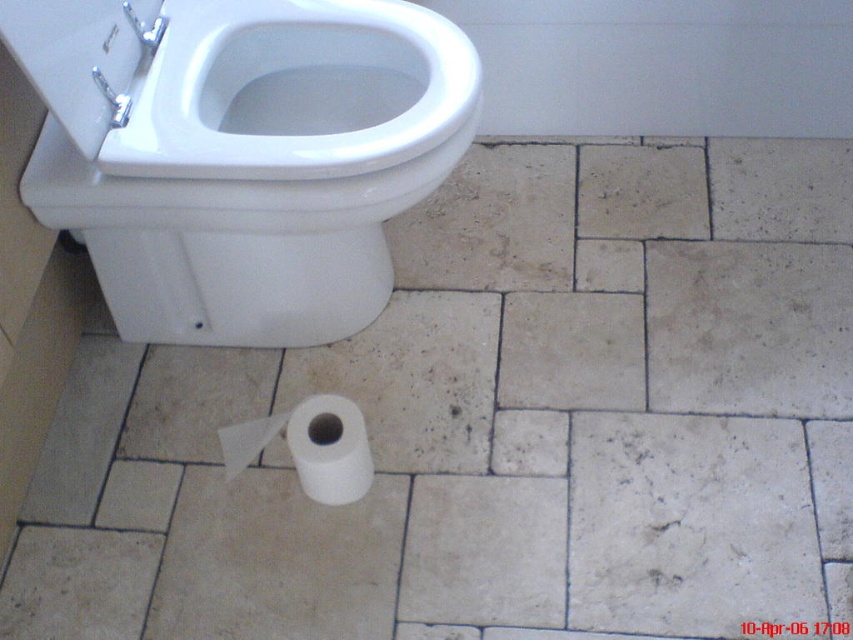
Question: Which point is farther to the camera?

Choices:
 (A) white glossy toilet bowl at upper left
 (B) white matte toilet paper at lower center

Answer: (B)

Question: Can you confirm if white glossy toilet bowl at upper left is positioned to the right of white matte toilet paper at lower center?

Choices:
 (A) no
 (B) yes

Answer: (A)

Question: Observing the image, what is the correct spatial positioning of white glossy toilet bowl at upper left in reference to white matte toilet paper at lower center?

Choices:
 (A) right
 (B) left

Answer: (B)

Question: Does white glossy toilet bowl at upper left have a smaller size compared to white matte toilet paper at lower center?

Choices:
 (A) no
 (B) yes

Answer: (A)